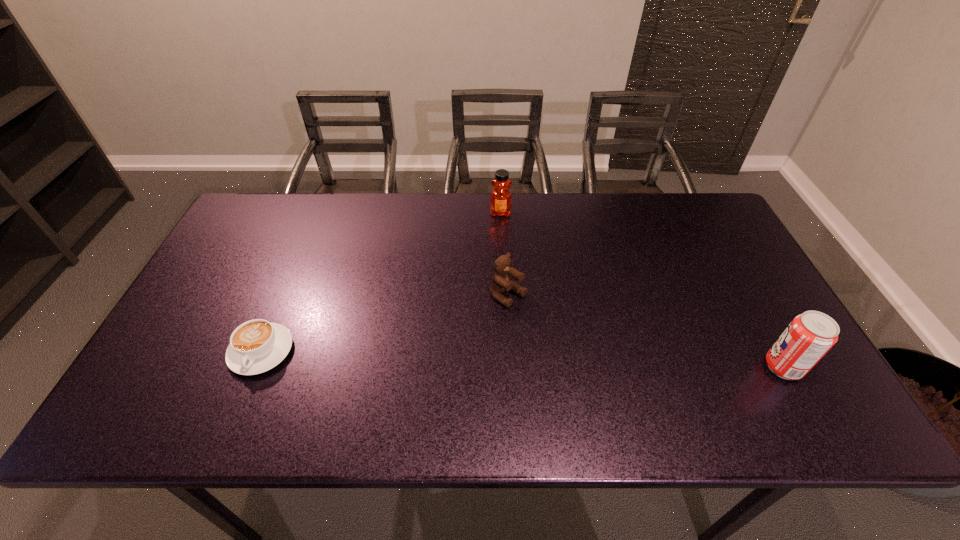
You are a GUI agent. You are given a task and a screenshot of the screen. Output one action in this format:
    pyautogui.click(x=<x>, y=<y>)
    Task: Click on the free point between the shortest object and the teddy bear
    The width and height of the screenshot is (960, 540).
    Given the screenshot: What is the action you would take?
    pyautogui.click(x=385, y=323)

You are a GUI agent. You are given a task and a screenshot of the screen. Output one action in this format:
    pyautogui.click(x=<x>, y=<y>)
    Task: Click on the vacant area that lies between the second farthest object and the soda can
    
    Given the screenshot: What is the action you would take?
    pyautogui.click(x=646, y=332)

Identify which object is located as the nearest to the soda can. Please provide its 2D coordinates. Your answer should be formatted as a tuple, i.e. [(x, y)], where the tuple contains the x and y coordinates of a point satisfying the conditions above.

[(501, 282)]

Identify which object is located as the third nearest to the teddy bear. Please provide its 2D coordinates. Your answer should be formatted as a tuple, i.e. [(x, y)], where the tuple contains the x and y coordinates of a point satisfying the conditions above.

[(809, 336)]

In order to click on free spot that satisfies the following two spatial constraints: 1. on the front side of the second shortest object; 2. on the right side of the honey in this screenshot , I will do `click(505, 296)`.